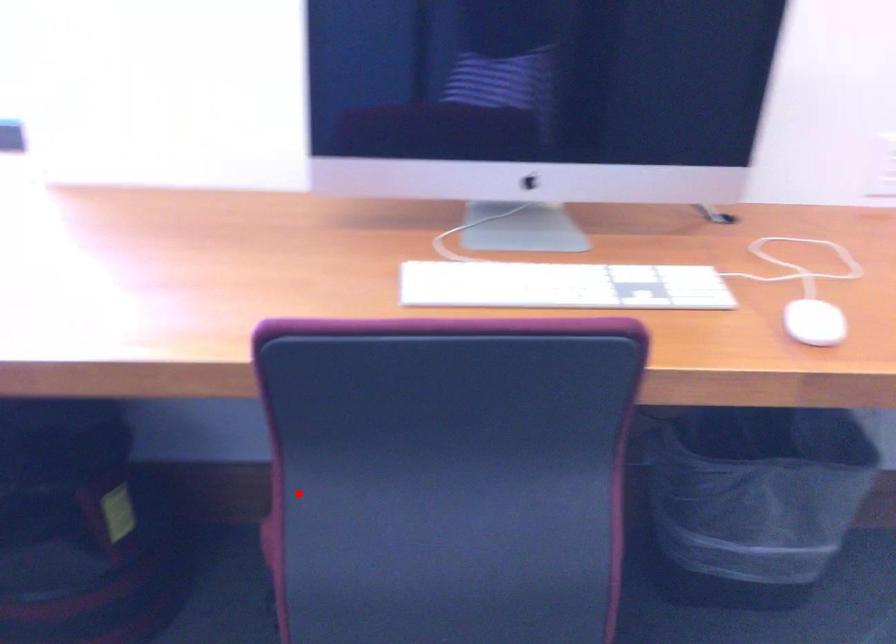
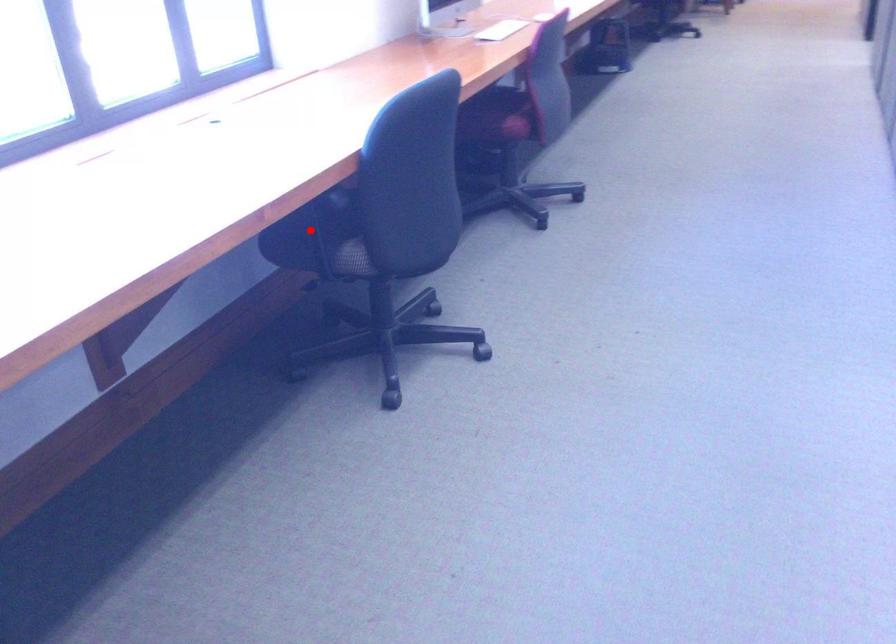
I am providing you with two images of the same scene from different viewpoints. A red point is marked on the first image and another point is marked on the second image. Do the highlighted points in image1 and image2 indicate the same real-world spot?

No